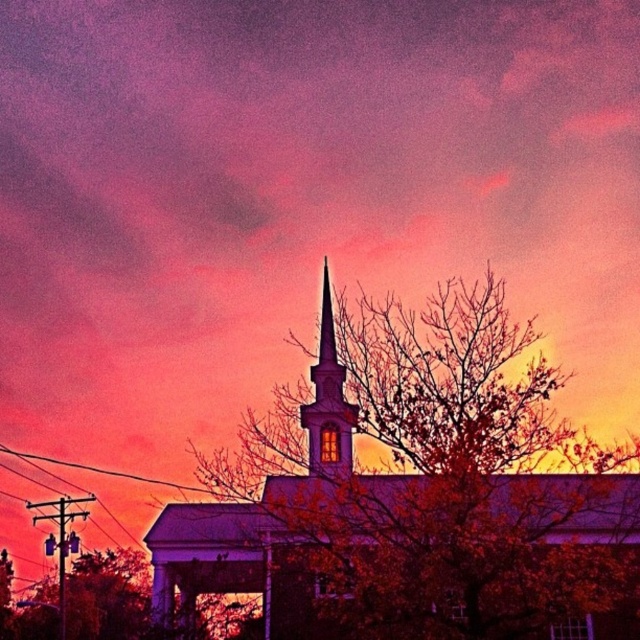
Question: Can you confirm if white stucco church at center is positioned below smooth white steeple at center?

Choices:
 (A) yes
 (B) no

Answer: (A)

Question: Is white stucco church at center thinner than smooth white steeple at center?

Choices:
 (A) yes
 (B) no

Answer: (B)

Question: Is white stucco church at center positioned at the back of smooth white steeple at center?

Choices:
 (A) yes
 (B) no

Answer: (B)

Question: Which point is farther from the camera taking this photo?

Choices:
 (A) (332, 403)
 (B) (326, 522)

Answer: (A)

Question: Which of the following is the farthest from the observer?

Choices:
 (A) (308, 440)
 (B) (182, 545)

Answer: (A)